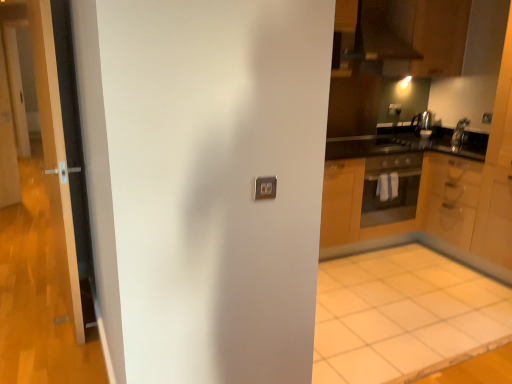
Identify the location of wooden cabinet at right, placed as the second cabinetry when sorted from left to right. (451, 198).

What do you see at coordinates (403, 316) in the screenshot? I see `white tile floor at lower right` at bounding box center [403, 316].

Find the location of a particular element. The image size is (512, 384). wooden cabinet at center, the second cabinetry viewed from the right is located at coordinates pos(348,209).

At what (x,y) coordinates should I click in order to perform the action: click on transparent glass door at left. Please return your answer as a coordinate pair (x, y). This screenshot has width=512, height=384. Looking at the image, I should click on (40, 288).

I want to click on satin silver kettle at upper right, the first appliance from the back, so click(x=423, y=123).

Considering the positions of objects satin silver kettle at upper right, the first appliance positioned from the right, and wooden cabinet at center, which is the 1th cabinetry in left-to-right order, in the image provided, who is behind, satin silver kettle at upper right, the first appliance positioned from the right, or wooden cabinet at center, which is the 1th cabinetry in left-to-right order,?

satin silver kettle at upper right, the first appliance positioned from the right, is further from the camera.

In terms of size, does satin silver kettle at upper right, the first appliance positioned from the right, appear bigger or smaller than wooden cabinet at center, the second cabinetry viewed from the right?

Clearly, satin silver kettle at upper right, the first appliance positioned from the right, is smaller in size than wooden cabinet at center, the second cabinetry viewed from the right.

Which cabinetry is the 1st one when counting from the front of the satin silver kettle at upper right, the first appliance positioned from the right? Please provide its 2D coordinates.

[(348, 209)]

Consider the image. Is white tile floor at lower right in front of or behind clear glass screen door at left in the image?

Clearly, white tile floor at lower right is in front of clear glass screen door at left.

Is point (447, 314) closer or farther from the camera than point (2, 163)?

Point (447, 314) appears to be closer to the viewer than point (2, 163).

How much distance is there between white tile floor at lower right and clear glass screen door at left?

white tile floor at lower right is 11.84 feet from clear glass screen door at left.

From a real-world perspective, is white tile floor at lower right beneath clear glass screen door at left?

Yes, from a real-world perspective, white tile floor at lower right is under clear glass screen door at left.

Does satin silver kettle at upper right, which is counted as the second appliance, starting from the left, turn towards white tile floor at lower right?

No, satin silver kettle at upper right, which is counted as the second appliance, starting from the left, is not oriented towards white tile floor at lower right.

Who is bigger, satin silver kettle at upper right, which is counted as the second appliance, starting from the left, or white tile floor at lower right?

white tile floor at lower right.

Which object is positioned more to the right, satin silver kettle at upper right, which is counted as the second appliance, starting from the left, or white tile floor at lower right?

satin silver kettle at upper right, which is counted as the second appliance, starting from the left, is more to the right.

Is satin silver kettle at upper right, the 2th appliance when ordered from back to front, inside the boundaries of white tile floor at lower right, or outside?

satin silver kettle at upper right, the 2th appliance when ordered from back to front, cannot be found inside white tile floor at lower right.

Is matte silver outlet at center, which is the second electric outlet in right-to-left order, turned away from satin silver exhaust hood at upper center?

No, matte silver outlet at center, which is the second electric outlet in right-to-left order, is not facing the opposite direction of satin silver exhaust hood at upper center.

Is satin silver exhaust hood at upper center surrounded by matte silver outlet at center, placed as the 1th electric outlet when sorted from back to front?

That's incorrect, satin silver exhaust hood at upper center is not inside matte silver outlet at center, placed as the 1th electric outlet when sorted from back to front.

From the image's perspective, would you say matte silver outlet at center, which is the first electric outlet in top-to-bottom order, is positioned over satin silver exhaust hood at upper center?

No, from the image's perspective, matte silver outlet at center, which is the first electric outlet in top-to-bottom order, is not above satin silver exhaust hood at upper center.

Is matte silver outlet at center, which is the first electric outlet in top-to-bottom order, wider than satin silver exhaust hood at upper center?

Incorrect, the width of matte silver outlet at center, which is the first electric outlet in top-to-bottom order, does not surpass that of satin silver exhaust hood at upper center.

Which of these two, white tile floor at lower right or satin silver exhaust hood at upper center, is smaller?

Smaller between the two is satin silver exhaust hood at upper center.

From the picture: In terms of width, does white tile floor at lower right look wider or thinner when compared to satin silver exhaust hood at upper center?

Considering their sizes, white tile floor at lower right looks broader than satin silver exhaust hood at upper center.

Which of these two, white tile floor at lower right or satin silver exhaust hood at upper center, stands shorter?

white tile floor at lower right.

Is white tile floor at lower right to the left or to the right of satin silver exhaust hood at upper center in the image?

Clearly, white tile floor at lower right is on the left of satin silver exhaust hood at upper center in the image.

Locate an element on the screen. Image resolution: width=512 pixels, height=384 pixels. the 2nd appliance below the matte silver outlet at center, which is the first electric outlet in top-to-bottom order (from a real-world perspective) is located at coordinates (459, 131).

Is matte silver outlet at center, placed as the 1th electric outlet when sorted from back to front, far away from satin silver kettle at upper right, the first appliance positioned from the right?

No.

Considering the sizes of matte silver outlet at center, which is the second electric outlet in right-to-left order, and satin silver kettle at upper right, which is counted as the second appliance, starting from the left, in the image, is matte silver outlet at center, which is the second electric outlet in right-to-left order, taller or shorter than satin silver kettle at upper right, which is counted as the second appliance, starting from the left,?

Clearly, matte silver outlet at center, which is the second electric outlet in right-to-left order, is shorter compared to satin silver kettle at upper right, which is counted as the second appliance, starting from the left.

Which is behind, point (399, 25) or point (21, 288)?

The point (399, 25) is more distant.

Is satin silver exhaust hood at upper center taller than transparent glass door at left?

No.

From a real-world perspective, which object rests below the other?

In real-world perspective, transparent glass door at left is lower.

You are a GUI agent. You are given a task and a screenshot of the screen. Output one action in this format:
    pyautogui.click(x=<x>, y=<y>)
    Task: Click on the 2nd cabinetry to the left of the satin silver kettle at upper right, the first appliance positioned from the right, counting from the anchor's position
    
    Given the screenshot: What is the action you would take?
    pyautogui.click(x=348, y=209)

The height and width of the screenshot is (384, 512). Find the location of `screen door that appears above the white tile floor at lower right (from a real-world perspective)`. screen door that appears above the white tile floor at lower right (from a real-world perspective) is located at coordinates (7, 139).

Based on their spatial positions, is matte gray electric outlet at upper right, acting as the first electric outlet starting from the front, or wooden cabinet at right, which ranks as the first cabinetry in right-to-left order, closer to transparent glass door at left?

wooden cabinet at right, which ranks as the first cabinetry in right-to-left order, is positioned closer to the anchor transparent glass door at left.

When comparing their distances from satin silver kettle at upper right, which ranks as the 2th appliance in front-to-back order, does clear glass screen door at left or wooden cabinet at center, the second cabinetry viewed from the right, seem closer?

Based on the image, wooden cabinet at center, the second cabinetry viewed from the right, appears to be nearer to satin silver kettle at upper right, which ranks as the 2th appliance in front-to-back order.

Based on their spatial positions, is white tile floor at lower right or clear glass screen door at left closer to transparent glass door at left?

clear glass screen door at left is positioned closer to the anchor transparent glass door at left.

When comparing their distances from white tile floor at lower right, does transparent glass door at left or matte gray electric outlet at upper right, the first electric outlet from the bottom, seem closer?

The object closer to white tile floor at lower right is matte gray electric outlet at upper right, the first electric outlet from the bottom.

Looking at the image, which one is located closer to white tile floor at lower right, transparent glass door at left or satin silver kettle at upper right, the second appliance from the right?

satin silver kettle at upper right, the second appliance from the right.

When comparing their distances from wooden cabinet at center, the second cabinetry viewed from the right, does satin silver kettle at upper right, the first appliance from the front, or matte gray electric outlet at upper right, acting as the first electric outlet starting from the front, seem closer?

The object closer to wooden cabinet at center, the second cabinetry viewed from the right, is satin silver kettle at upper right, the first appliance from the front.

From the picture: Looking at the image, which one is located further to satin silver exhaust hood at upper center, matte silver outlet at center, placed as the 1th electric outlet when sorted from back to front, or matte gray electric outlet at upper right, which appears as the 2th electric outlet when viewed from the left?

matte gray electric outlet at upper right, which appears as the 2th electric outlet when viewed from the left, lies further to satin silver exhaust hood at upper center than the other object.

Which object lies nearer to the anchor point wooden cabinet at center, which is the 1th cabinetry in left-to-right order, satin silver kettle at upper right, the second appliance from the right, or satin silver exhaust hood at upper center?

satin silver kettle at upper right, the second appliance from the right, is positioned closer to the anchor wooden cabinet at center, which is the 1th cabinetry in left-to-right order.

Locate an element on the screen. Image resolution: width=512 pixels, height=384 pixels. door between clear glass screen door at left and wooden cabinet at right, placed as the second cabinetry when sorted from left to right, in the horizontal direction is located at coordinates (40, 288).

Identify the location of electric outlet between transparent glass door at left and wooden cabinet at right, which ranks as the first cabinetry in right-to-left order, from left to right. The height and width of the screenshot is (384, 512). (394, 109).

Locate an element on the screen. The image size is (512, 384). plain situated between clear glass screen door at left and matte silver outlet at center, which is the first electric outlet in top-to-bottom order, from left to right is located at coordinates (403, 316).

Locate an element on the screen. cabinetry situated between transparent glass door at left and wooden cabinet at right, placed as the second cabinetry when sorted from left to right, from left to right is located at coordinates click(x=348, y=209).